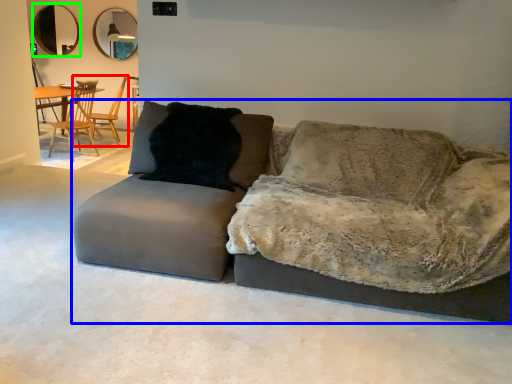
Question: Which object is the closest to the chair (highlighted by a red box)? Choose among these: studio couch (highlighted by a blue box) or mirror (highlighted by a green box).

Choices:
 (A) studio couch
 (B) mirror

Answer: (B)